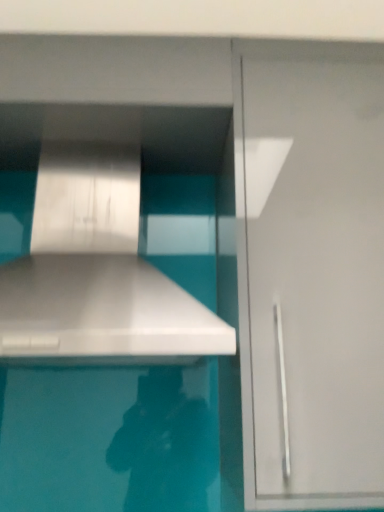
The image size is (384, 512). Describe the element at coordinates (97, 272) in the screenshot. I see `white glossy vent at center` at that location.

This screenshot has height=512, width=384. In order to click on white glossy vent at center in this screenshot , I will do `click(97, 272)`.

Identify the location of white glossy vent at center. (97, 272).